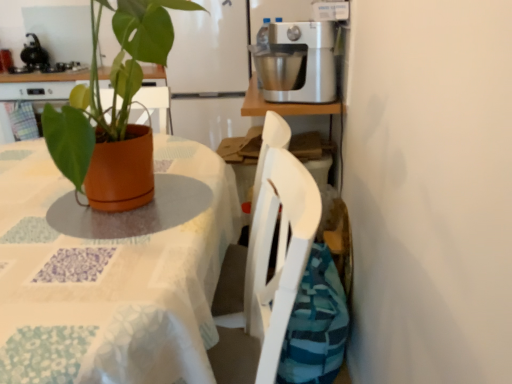
Question: In terms of height, does terracotta pot at left look taller or shorter compared to brushed metal mixer at upper center?

Choices:
 (A) short
 (B) tall

Answer: (B)

Question: From the image's perspective, relative to brushed metal mixer at upper center, is terracotta pot at left above or below?

Choices:
 (A) above
 (B) below

Answer: (B)

Question: Which object is positioned closest to the terracotta pot at left?

Choices:
 (A) terracotta pot at center
 (B) brushed metal mixer at upper center
 (C) satin silver mixer at upper right

Answer: (A)

Question: Based on their relative distances, which object is farther from the satin silver mixer at upper right?

Choices:
 (A) terracotta pot at left
 (B) brushed metal mixer at upper center
 (C) terracotta pot at center

Answer: (B)